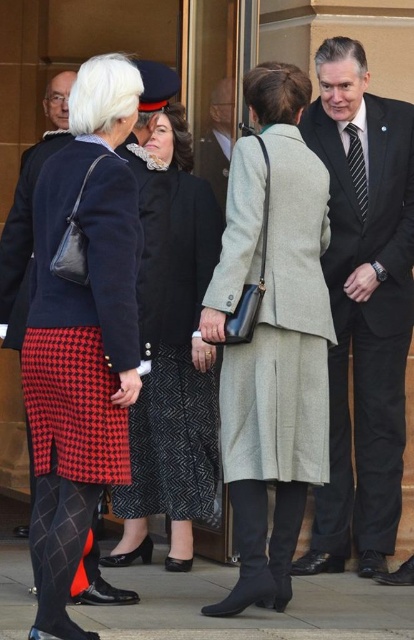
Does red houndstooth skirt at lower left have a lesser width compared to matte black sweater at center?

Yes, red houndstooth skirt at lower left is thinner than matte black sweater at center.

The image size is (414, 640). Identify the location of red houndstooth skirt at lower left. pyautogui.click(x=74, y=406).

Where is `red houndstooth skirt at lower left`? This screenshot has height=640, width=414. red houndstooth skirt at lower left is located at coordinates (74, 406).

Can you confirm if black silk suit at center is positioned below striped silk tie at center?

Correct, black silk suit at center is located below striped silk tie at center.

Which of these two, black silk suit at center or striped silk tie at center, stands taller?

With more height is black silk suit at center.

Where is `black silk suit at center`? This screenshot has width=414, height=640. black silk suit at center is located at coordinates (366, 326).

Between light gray wool coat at center and houndstooth skirt at left, which one appears on the left side from the viewer's perspective?

From the viewer's perspective, houndstooth skirt at left appears more on the left side.

Locate an element on the screen. The image size is (414, 640). light gray wool coat at center is located at coordinates point(279,355).